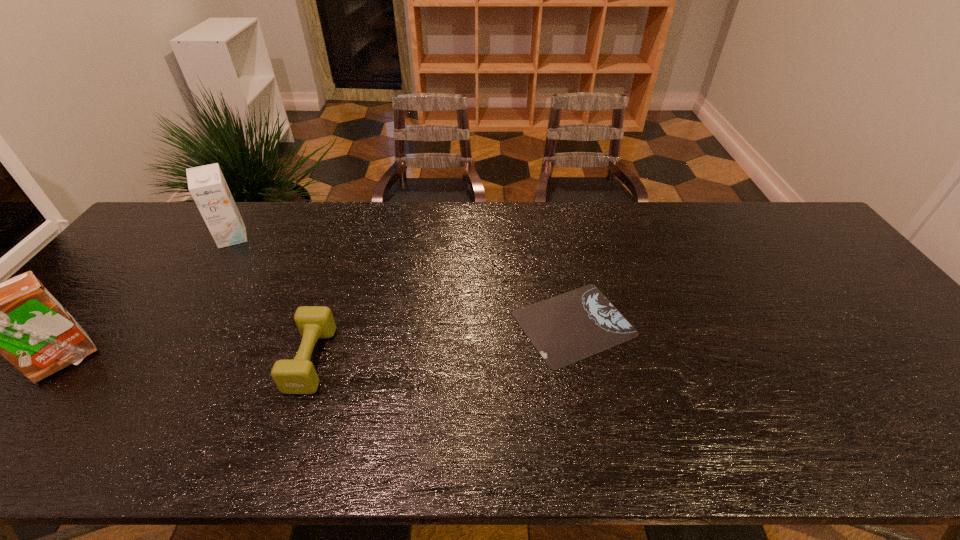
Where is `vacant space located on the back of the dumbbell`? vacant space located on the back of the dumbbell is located at coordinates (333, 295).

Locate an element on the screen. This screenshot has height=540, width=960. free space located on the back of the mousepad is located at coordinates (563, 268).

I want to click on object located at the far edge, so click(x=207, y=185).

At what (x,y) coordinates should I click in order to perform the action: click on object that is positioned at the left edge. Please return your answer as a coordinate pair (x, y). Image resolution: width=960 pixels, height=540 pixels. Looking at the image, I should click on (19, 319).

In the image, there is a desktop. At what (x,y) coordinates should I click in order to perform the action: click on free space at the far edge. Please return your answer as a coordinate pair (x, y). The height and width of the screenshot is (540, 960). Looking at the image, I should click on (674, 226).

Find the location of a particular element. The width and height of the screenshot is (960, 540). free point at the near edge is located at coordinates (143, 452).

Where is `free space at the right edge of the desktop`? The width and height of the screenshot is (960, 540). free space at the right edge of the desktop is located at coordinates (924, 403).

The width and height of the screenshot is (960, 540). In the image, there is a desktop. What are the coordinates of `blank space at the far left corner` in the screenshot? It's located at click(186, 240).

Locate an element on the screen. free space that is in between the right carton and the third object from left to right is located at coordinates (272, 299).

The height and width of the screenshot is (540, 960). I want to click on vacant area that lies between the second object from left to right and the second object from right to left, so click(272, 299).